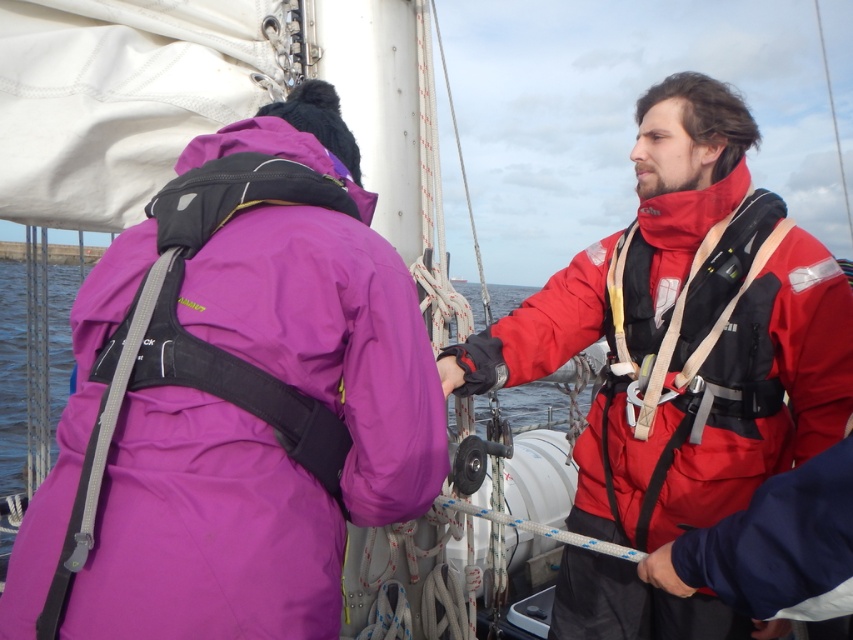
You are on a boat and need to retrieve an item from the water. The red matte life vest at center and transparent water at center are in your line of sight. Which object should you move towards if you want to reach the water first?

The transparent water at center is to the right of the red matte life vest at center. Since you want to reach the water first, you should move towards the transparent water at center directly.

You are standing on the deck of a boat and see a point marked at coordinates (x=396, y=369). If you want to reach that point without moving your feet, can you do it?

The point at coordinates (x=396, y=369) is 1.56 meters away from the viewer. Since the average arm length is about 0.7 meters, you cannot reach it without moving your feet.